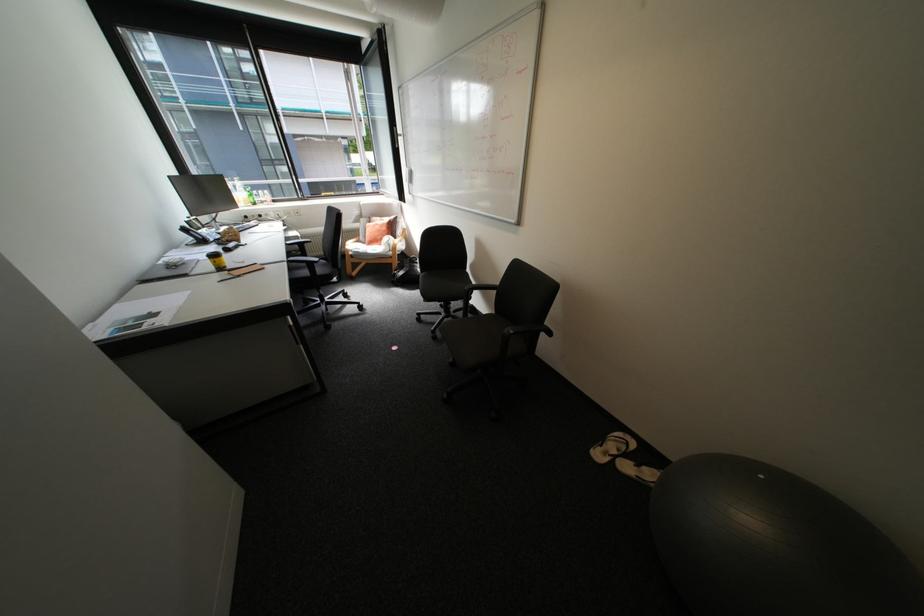
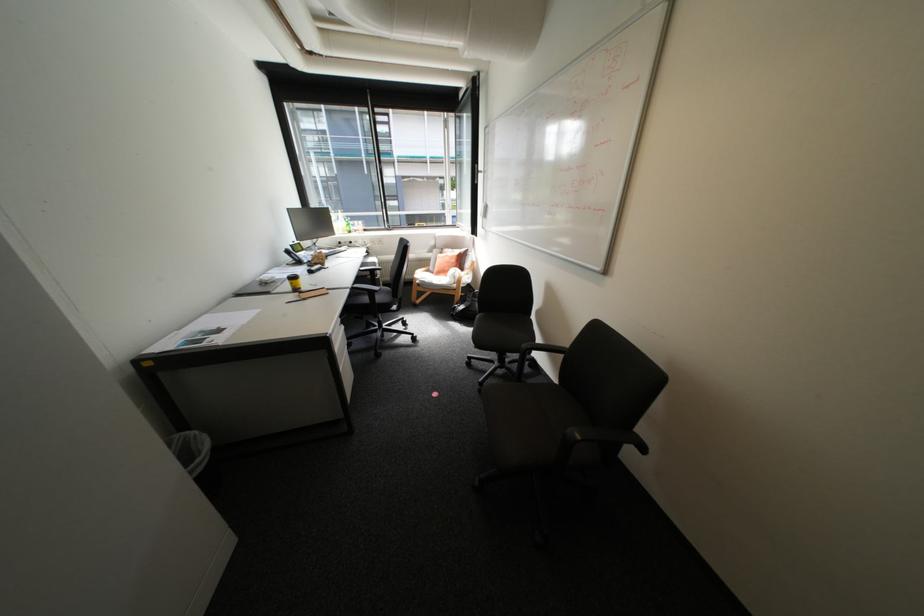
In the second image, find the point that corresponds to point 217,265 in the first image.

(296, 286)